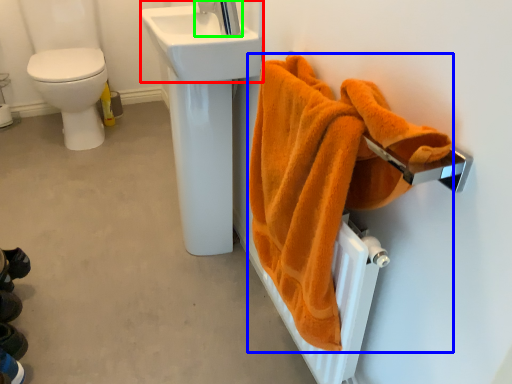
Question: Which is farther away from sink (highlighted by a red box)? towel (highlighted by a blue box) or tap (highlighted by a green box)?

Choices:
 (A) towel
 (B) tap

Answer: (A)